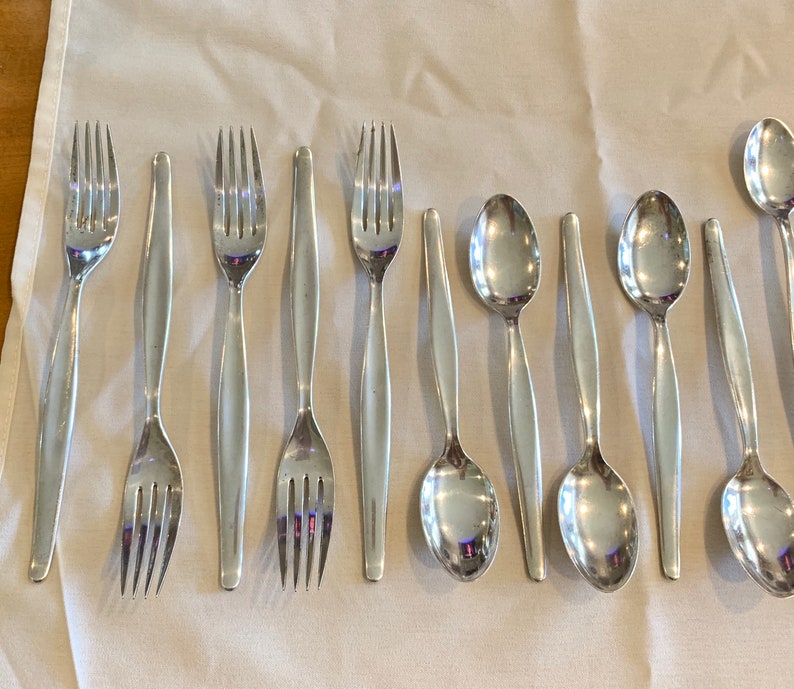
You are a GUI agent. You are given a task and a screenshot of the screen. Output one action in this format:
    pyautogui.click(x=<x>, y=<y>)
    Task: Click on the silverware with handle pointing up
    The image size is (794, 689).
    Given the screenshot: What is the action you would take?
    pyautogui.click(x=153, y=415), pyautogui.click(x=303, y=402), pyautogui.click(x=456, y=397), pyautogui.click(x=584, y=367), pyautogui.click(x=726, y=325)